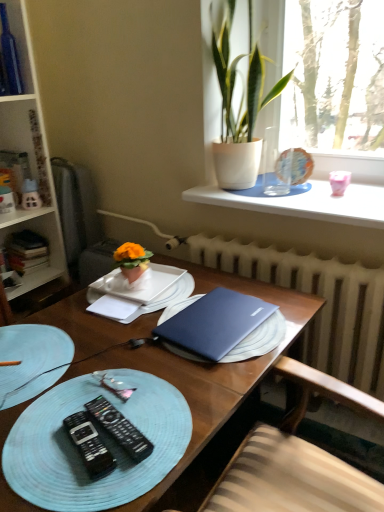
Find the location of a particular element. free space that is in between blue woven placemat at lower left, acting as the second tableware starting from the right, and white matte notebook at center is located at coordinates (86, 325).